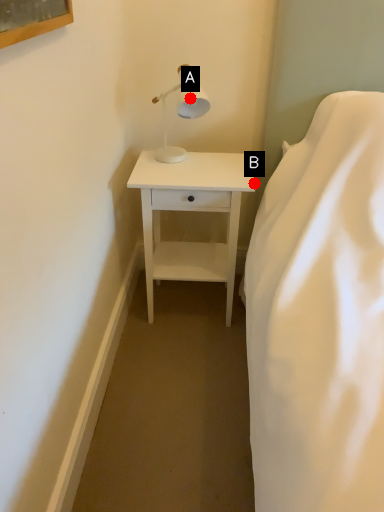
Question: Two points are circled on the image, labeled by A and B beside each circle. Among these points, which one is nearest to the camera?

Choices:
 (A) A is closer
 (B) B is closer

Answer: (A)